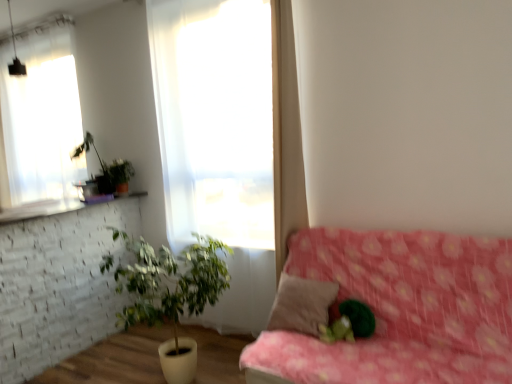
Where is `green fuzzy ball at center`? The width and height of the screenshot is (512, 384). green fuzzy ball at center is located at coordinates (349, 323).

Measure the distance between point (6, 50) and camera.

Point (6, 50) is 12.94 feet from camera.

What do you see at coordinates (401, 309) in the screenshot? The height and width of the screenshot is (384, 512). I see `pink floral fabric couch at lower right` at bounding box center [401, 309].

This screenshot has width=512, height=384. Describe the element at coordinates (106, 169) in the screenshot. I see `green leafy plant at upper left, which appears as the first houseplant when viewed from the back` at that location.

I want to click on green fuzzy ball at center, so click(349, 323).

Is green leafy plant at upper left, the second houseplant in the front-to-back sequence, in front of green leafy plant in white pot at lower left, which is the 2th houseplant from left to right?

No, green leafy plant at upper left, the second houseplant in the front-to-back sequence, is further to the viewer.

Does point (90, 146) lie behind point (148, 258)?

That is True.

Is green leafy plant at upper left, the second houseplant in the front-to-back sequence, oriented away from green leafy plant in white pot at lower left, which is the 1th houseplant from front to back?

green leafy plant at upper left, the second houseplant in the front-to-back sequence, is not turned away from green leafy plant in white pot at lower left, which is the 1th houseplant from front to back.

How many degrees apart are the facing directions of green leafy plant at upper left, the second houseplant in the front-to-back sequence, and green leafy plant in white pot at lower left, which is the 1th houseplant from front to back?

green leafy plant at upper left, the second houseplant in the front-to-back sequence, and green leafy plant in white pot at lower left, which is the 1th houseplant from front to back, are facing 90 degrees away from each other.

Which is more to the right, white sheer curtain at upper left, the first window when ordered from back to front, or green fuzzy ball at center?

green fuzzy ball at center is more to the right.

Considering the sizes of white sheer curtain at upper left, the 1th window from the left, and green fuzzy ball at center in the image, is white sheer curtain at upper left, the 1th window from the left, taller or shorter than green fuzzy ball at center?

Considering their sizes, white sheer curtain at upper left, the 1th window from the left, has more height than green fuzzy ball at center.

In the image, there is a white sheer curtain at upper left, acting as the 2th window starting from the front. Where is `plant below it (from a real-world perspective)`? The width and height of the screenshot is (512, 384). plant below it (from a real-world perspective) is located at coordinates (349, 323).

What's the angular difference between white sheer curtain at upper left, the first window when ordered from back to front, and green fuzzy ball at center's facing directions?

The facing directions of white sheer curtain at upper left, the first window when ordered from back to front, and green fuzzy ball at center are 4.35 degrees apart.

Between brown fabric pillow at center and pink floral fabric couch at lower right, which one appears on the right side from the viewer's perspective?

Positioned to the right is pink floral fabric couch at lower right.

Which object is further away from the camera taking this photo, brown fabric pillow at center or pink floral fabric couch at lower right?

brown fabric pillow at center is behind.

From the image's perspective, is brown fabric pillow at center above or below pink floral fabric couch at lower right?

brown fabric pillow at center is situated higher than pink floral fabric couch at lower right in the image.

Does brown fabric pillow at center have a lesser height compared to pink floral fabric couch at lower right?

Yes.

From a real-world perspective, which object rests below the other?

brown fabric pillow at center, from a real-world perspective.

Is brown fabric pillow at center further to the viewer compared to white sheer curtain at upper left, the first window when ordered from back to front?

No.

Does brown fabric pillow at center appear on the left side of white sheer curtain at upper left, the first window when ordered from back to front?

In fact, brown fabric pillow at center is to the right of white sheer curtain at upper left, the first window when ordered from back to front.

Does green fuzzy ball at center lie in front of translucent fabric at center, placed as the first window when sorted from front to back?

Yes, green fuzzy ball at center is closer to the viewer.

From the picture: What's the angular difference between green fuzzy ball at center and translucent fabric at center, the 2th window when ordered from left to right,'s facing directions?

The facing directions of green fuzzy ball at center and translucent fabric at center, the 2th window when ordered from left to right, are 4.35 degrees apart.

Which is more to the right, green fuzzy ball at center or translucent fabric at center, the first window in the right-to-left sequence?

Positioned to the right is green fuzzy ball at center.

From the image's perspective, is green leafy plant at upper left, the second houseplant in the front-to-back sequence, located above or below white sheer curtain at upper left, the 1th window from the left?

green leafy plant at upper left, the second houseplant in the front-to-back sequence, is below white sheer curtain at upper left, the 1th window from the left.

Identify the location of window that appears behind the green leafy plant at upper left, placed as the 2th houseplant when sorted from right to left. (41, 120).

Does point (123, 184) appear closer or farther from the camera than point (7, 206)?

Point (123, 184).

How distant is green leafy plant at upper left, the second houseplant in the bottom-to-top sequence, from white sheer curtain at upper left, the second window from the right?

green leafy plant at upper left, the second houseplant in the bottom-to-top sequence, is 61.94 centimeters away from white sheer curtain at upper left, the second window from the right.

From a real-world perspective, does green leafy plant at upper left, placed as the 2th houseplant when sorted from right to left, sit lower than green fuzzy ball at center?

No.

Could you tell me if green leafy plant at upper left, the first houseplant positioned from the left, is facing green fuzzy ball at center?

No.

Considering the relative sizes of green leafy plant at upper left, the second houseplant in the bottom-to-top sequence, and green fuzzy ball at center in the image provided, is green leafy plant at upper left, the second houseplant in the bottom-to-top sequence, thinner than green fuzzy ball at center?

In fact, green leafy plant at upper left, the second houseplant in the bottom-to-top sequence, might be wider than green fuzzy ball at center.

The image size is (512, 384). I want to click on houseplant above the green leafy plant in white pot at lower left, which is the 1th houseplant from front to back (from a real-world perspective), so click(x=106, y=169).

Locate an element on the screen. The height and width of the screenshot is (384, 512). the 2nd window positioned above the green fuzzy ball at center (from the image's perspective) is located at coordinates (41, 120).

Looking at the image, which one is located further to translucent fabric at center, placed as the first window when sorted from front to back, green leafy plant in white pot at lower left, which is counted as the first houseplant, starting from the bottom, or pink floral fabric couch at lower right?

pink floral fabric couch at lower right is positioned further to the anchor translucent fabric at center, placed as the first window when sorted from front to back.

Based on their spatial positions, is brown fabric pillow at center or translucent fabric at center, placed as the first window when sorted from front to back, closer to green leafy plant at upper left, placed as the 1th houseplant when sorted from top to bottom?

translucent fabric at center, placed as the first window when sorted from front to back, is positioned closer to the anchor green leafy plant at upper left, placed as the 1th houseplant when sorted from top to bottom.

When comparing their distances from translucent fabric at center, the 2th window when ordered from left to right, does brown fabric pillow at center or white sheer curtain at upper left, the second window from the right, seem closer?

The object closer to translucent fabric at center, the 2th window when ordered from left to right, is brown fabric pillow at center.

Looking at the image, which one is located closer to brown fabric pillow at center, green leafy plant at upper left, placed as the 2th houseplant when sorted from right to left, or green leafy plant in white pot at lower left, placed as the first houseplant when sorted from right to left?

green leafy plant in white pot at lower left, placed as the first houseplant when sorted from right to left.

Considering their positions, is green leafy plant in white pot at lower left, which is the 1th houseplant from front to back, positioned closer to translucent fabric at center, placed as the first window when sorted from front to back, than green leafy plant at upper left, placed as the 2th houseplant when sorted from right to left?

Based on the image, green leafy plant in white pot at lower left, which is the 1th houseplant from front to back, appears to be nearer to translucent fabric at center, placed as the first window when sorted from front to back.

Based on their spatial positions, is white sheer curtain at upper left, the 1th window from the left, or green leafy plant at upper left, placed as the 2th houseplant when sorted from right to left, further from brown fabric pillow at center?

The object further to brown fabric pillow at center is white sheer curtain at upper left, the 1th window from the left.

Based on their spatial positions, is translucent fabric at center, the 2th window when ordered from left to right, or green leafy plant at upper left, the second houseplant in the bottom-to-top sequence, further from brown fabric pillow at center?

green leafy plant at upper left, the second houseplant in the bottom-to-top sequence.

From the image, which object appears to be farther from pink floral fabric couch at lower right, translucent fabric at center, the 2th window when ordered from left to right, or white sheer curtain at upper left, the second window from the right?

white sheer curtain at upper left, the second window from the right, is further to pink floral fabric couch at lower right.

Where is `window located between pink floral fabric couch at lower right and green leafy plant at upper left, placed as the 2th houseplant when sorted from right to left, in the depth direction`? The width and height of the screenshot is (512, 384). window located between pink floral fabric couch at lower right and green leafy plant at upper left, placed as the 2th houseplant when sorted from right to left, in the depth direction is located at coordinates (217, 117).

Where is `houseplant between pink floral fabric couch at lower right and green leafy plant at upper left, the first houseplant positioned from the left, in the front-back direction`? The height and width of the screenshot is (384, 512). houseplant between pink floral fabric couch at lower right and green leafy plant at upper left, the first houseplant positioned from the left, in the front-back direction is located at coordinates (170, 293).

You are a GUI agent. You are given a task and a screenshot of the screen. Output one action in this format:
    pyautogui.click(x=<x>, y=<y>)
    Task: Click on the houseplant between green leafy plant in white pot at lower left, placed as the second houseplant when sorted from back to front, and white sheer curtain at upper left, the first window when ordered from back to front, along the z-axis
    
    Given the screenshot: What is the action you would take?
    pyautogui.click(x=106, y=169)

This screenshot has width=512, height=384. I want to click on pillow situated between white sheer curtain at upper left, the first window when ordered from back to front, and green fuzzy ball at center from left to right, so click(301, 304).